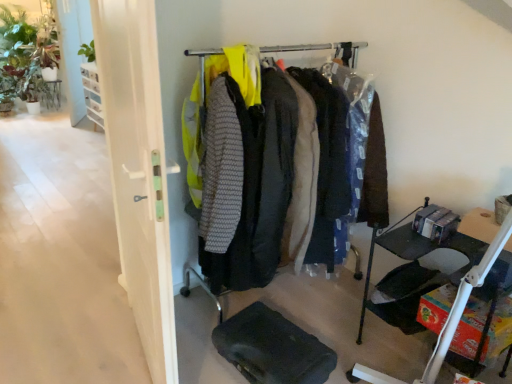
Question: From a real-world perspective, is black rubber footrest at lower center positioned over black fabric folding chair at lower right based on gravity?

Choices:
 (A) no
 (B) yes

Answer: (A)

Question: From the image's perspective, is black rubber footrest at lower center under black fabric folding chair at lower right?

Choices:
 (A) no
 (B) yes

Answer: (B)

Question: Is black rubber footrest at lower center touching black fabric folding chair at lower right?

Choices:
 (A) yes
 (B) no

Answer: (B)

Question: Is black rubber footrest at lower center behind black fabric folding chair at lower right?

Choices:
 (A) no
 (B) yes

Answer: (A)

Question: From a real-world perspective, is black rubber footrest at lower center positioned under black fabric folding chair at lower right based on gravity?

Choices:
 (A) yes
 (B) no

Answer: (A)

Question: Is matte black tray at lower right spatially inside white glossy door at left, or outside of it?

Choices:
 (A) inside
 (B) outside

Answer: (B)

Question: From the image's perspective, is matte black tray at lower right located above or below white glossy door at left?

Choices:
 (A) above
 (B) below

Answer: (B)

Question: Is matte black tray at lower right in front of or behind white glossy door at left in the image?

Choices:
 (A) behind
 (B) front

Answer: (A)

Question: Is point (359, 370) closer or farther from the camera than point (138, 283)?

Choices:
 (A) farther
 (B) closer

Answer: (A)

Question: From the image's perspective, is matte black clothing rack at center above or below white glossy door at left?

Choices:
 (A) above
 (B) below

Answer: (A)

Question: From a real-world perspective, is matte black clothing rack at center above or below white glossy door at left?

Choices:
 (A) below
 (B) above

Answer: (A)

Question: Relative to white glossy door at left, is matte black clothing rack at center in front or behind?

Choices:
 (A) front
 (B) behind

Answer: (B)

Question: Choose the correct answer: Is matte black clothing rack at center inside white glossy door at left or outside it?

Choices:
 (A) outside
 (B) inside

Answer: (A)

Question: Is matte black tray at lower right spatially inside matte black clothing rack at center, or outside of it?

Choices:
 (A) inside
 (B) outside

Answer: (B)

Question: From a real-world perspective, is matte black tray at lower right physically located above or below matte black clothing rack at center?

Choices:
 (A) below
 (B) above

Answer: (A)